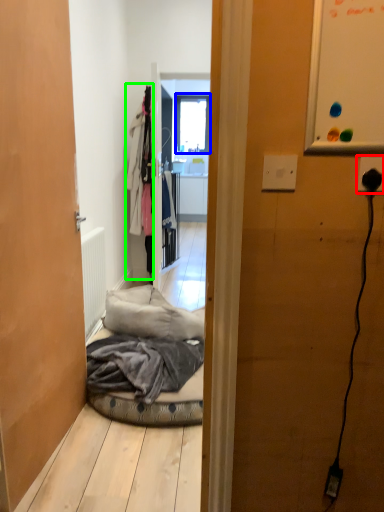
Question: Which object is positioned farthest from electric outlet (highlighted by a red box)? Select from window (highlighted by a blue box) and clothing (highlighted by a green box).

Choices:
 (A) window
 (B) clothing

Answer: (A)